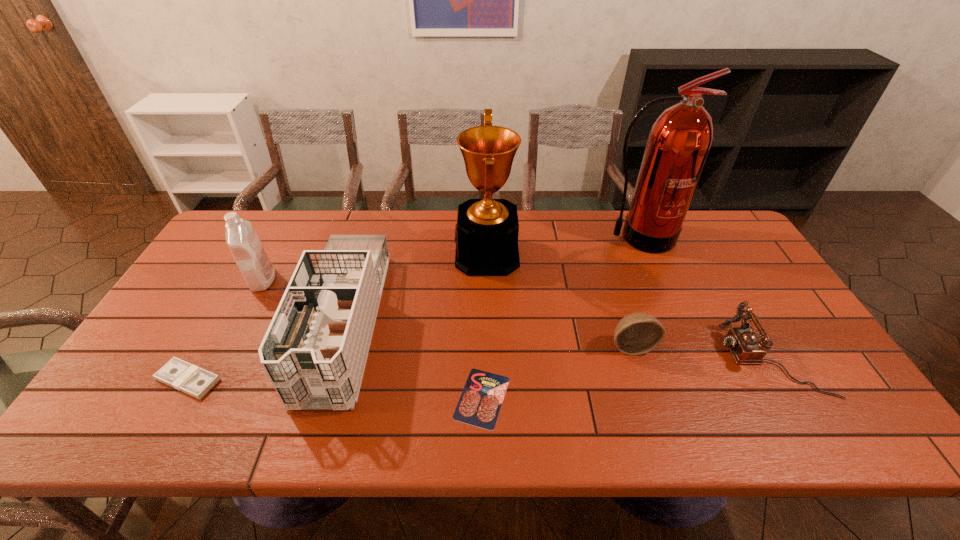
The image size is (960, 540). Identify the location of vacant region located on the back of the salami. (482, 322).

Identify the location of fire extinguisher positioned at the far edge. click(x=680, y=140).

You are a GUI agent. You are given a task and a screenshot of the screen. Output one action in this format:
    pyautogui.click(x=<x>, y=<y>)
    Task: Click on the trophy cup that is at the far edge
    Image resolution: width=960 pixels, height=540 pixels.
    Given the screenshot: What is the action you would take?
    pyautogui.click(x=486, y=235)

Locate an element on the screen. dollhouse that is at the near edge is located at coordinates (314, 352).

You are a GUI agent. You are given a task and a screenshot of the screen. Output one action in this format:
    pyautogui.click(x=<x>, y=<y>)
    Task: Click on the salami present at the near edge
    The height and width of the screenshot is (540, 960).
    Given the screenshot: What is the action you would take?
    pyautogui.click(x=479, y=405)

The height and width of the screenshot is (540, 960). What are the coordinates of `object at the left edge` in the screenshot? It's located at (181, 375).

The width and height of the screenshot is (960, 540). I want to click on object at the right edge, so click(744, 344).

At what (x,y) coordinates should I click in order to perform the action: click on vacant space at the far edge of the desktop. Please return your answer as a coordinate pair (x, y). Looking at the image, I should click on (605, 242).

You are a GUI agent. You are given a task and a screenshot of the screen. Output one action in this format:
    pyautogui.click(x=<x>, y=<y>)
    Task: Click on the vacant space at the near edge of the desktop
    The height and width of the screenshot is (540, 960).
    Given the screenshot: What is the action you would take?
    pyautogui.click(x=319, y=418)

In the image, there is a desktop. What are the coordinates of `vacant region at the left edge` in the screenshot? It's located at (229, 281).